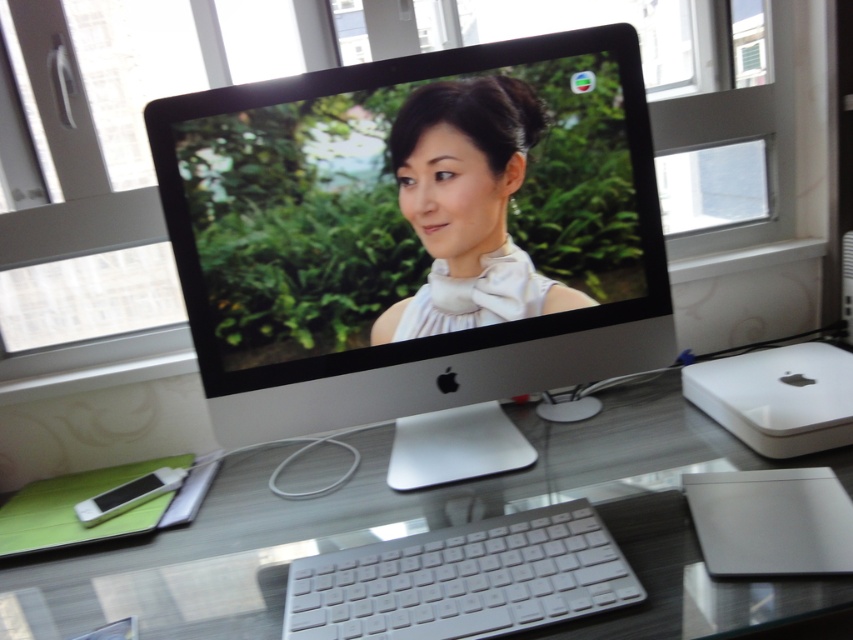
Is transparent glass desk at center positioned in front of white plastic minimac at lower right?

Yes.

Between transparent glass desk at center and white plastic minimac at lower right, which one appears on the right side from the viewer's perspective?

From the viewer's perspective, white plastic minimac at lower right appears more on the right side.

Is point (70, 556) positioned in front of point (788, 433)?

No, it is behind (788, 433).

You are a GUI agent. You are given a task and a screenshot of the screen. Output one action in this format:
    pyautogui.click(x=<x>, y=<y>)
    Task: Click on the transparent glass desk at center
    This screenshot has width=853, height=640.
    Given the screenshot: What is the action you would take?
    pyautogui.click(x=432, y=529)

Which of these two, white plastic keyboard at center or white plastic minimac at lower right, stands shorter?

With less height is white plastic keyboard at center.

Which is in front, point (555, 548) or point (740, 401)?

Point (555, 548) is in front.

Locate an element on the screen. The image size is (853, 640). white plastic keyboard at center is located at coordinates (463, 579).

From the picture: How much distance is there between silver metallic laptop at lower right and white plastic minimac at lower right?

They are 6.27 inches apart.

Is silver metallic laptop at lower right positioned behind white plastic minimac at lower right?

No, it is not.

Is point (822, 492) more distant than point (828, 442)?

No, (822, 492) is in front of (828, 442).

This screenshot has height=640, width=853. In order to click on silver metallic laptop at lower right in this screenshot , I will do `click(770, 522)`.